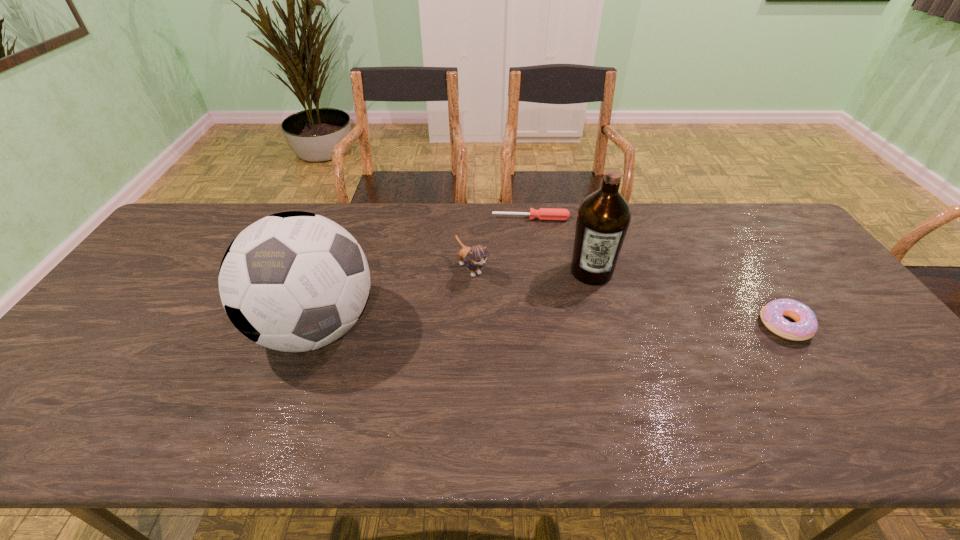
At what (x,y) coordinates should I click in order to perform the action: click on blank space located 0.280m at the tip of the farthest object. Please return your answer as a coordinate pair (x, y). The height and width of the screenshot is (540, 960). Looking at the image, I should click on (533, 279).

Identify the location of free spot located at the tip of the farthest object. Image resolution: width=960 pixels, height=540 pixels. (533, 288).

Identify the location of vacant position located 0.220m on the front-facing side of the kitten. (523, 334).

Where is `free point located on the front-facing side of the kitten`? This screenshot has width=960, height=540. free point located on the front-facing side of the kitten is located at coordinates (533, 345).

Find the location of `vacant space located 0.090m on the front-facing side of the kitten`. vacant space located 0.090m on the front-facing side of the kitten is located at coordinates (497, 302).

This screenshot has height=540, width=960. Find the location of `free region located on the label of the olive oil`. free region located on the label of the olive oil is located at coordinates click(x=592, y=339).

Locate an element on the screen. Image resolution: width=960 pixels, height=540 pixels. vacant area situated 0.220m on the label of the olive oil is located at coordinates (x=592, y=348).

Where is `vacant space positioned on the label of the olive oil`? The image size is (960, 540). vacant space positioned on the label of the olive oil is located at coordinates (592, 348).

You are a GUI agent. You are given a task and a screenshot of the screen. Output one action in this format:
    pyautogui.click(x=<x>, y=<y>)
    Task: Click on the object that is at the far edge
    The image size is (960, 540).
    Given the screenshot: What is the action you would take?
    pyautogui.click(x=555, y=214)

What are the coordinates of `object at the near edge` in the screenshot? It's located at (293, 281).